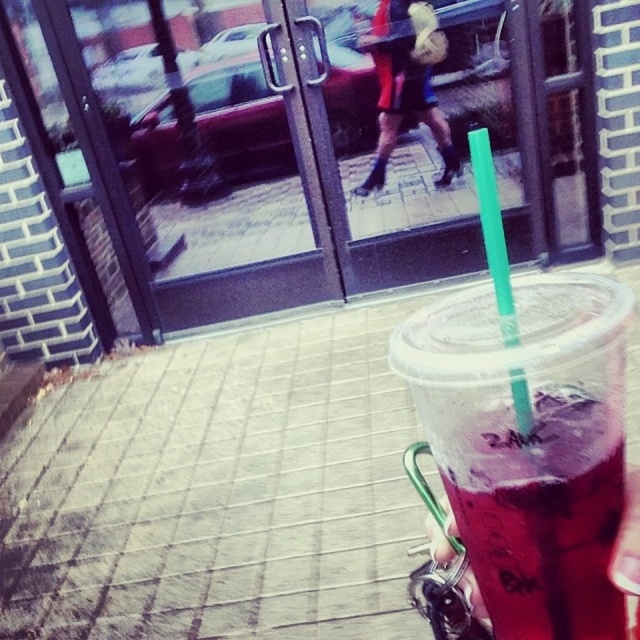
Can you confirm if green plastic straw at center is shorter than purple translucent cup at lower right?

In fact, green plastic straw at center may be taller than purple translucent cup at lower right.

Does point (516, 394) come in front of point (632, 483)?

Yes, point (516, 394) is closer to viewer.

Locate an element on the screen. green plastic straw at center is located at coordinates (492, 232).